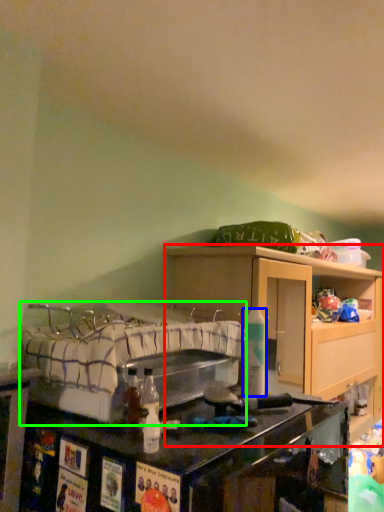
Question: Which object is the closest to the cabinetry (highlighted by a red box)? Choose among these: bottle (highlighted by a blue box) or bed (highlighted by a green box).

Choices:
 (A) bottle
 (B) bed

Answer: (B)